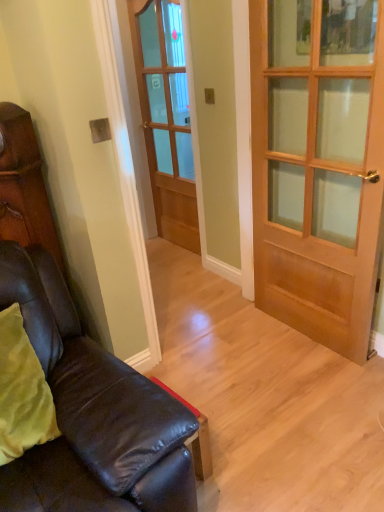
This screenshot has height=512, width=384. I want to click on vacant area that is in front of wooden door at center, arranged as the first door when viewed from the front, so click(x=306, y=387).